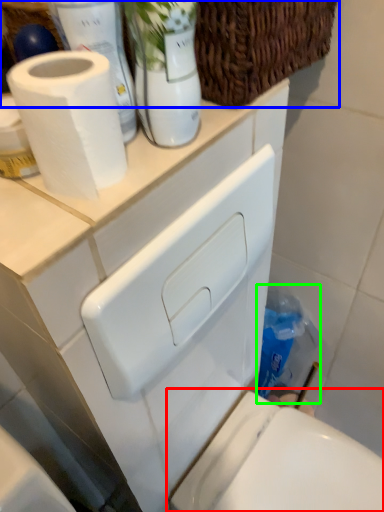
Question: Which is farther away from toilet (highlighted by a red box)? basket (highlighted by a blue box) or cleaning product (highlighted by a green box)?

Choices:
 (A) basket
 (B) cleaning product

Answer: (A)